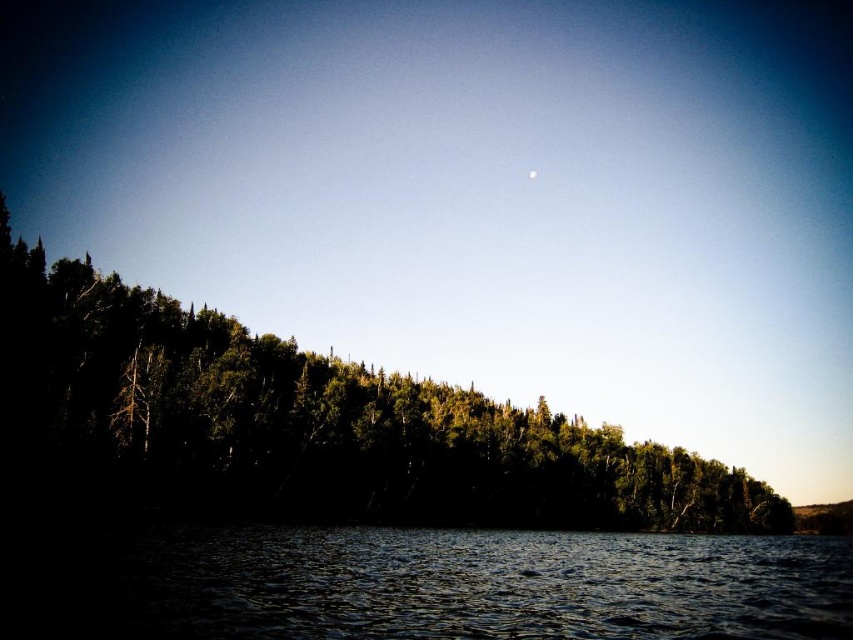
You are standing at the point marked as point (358,484) in the forest scene. You want to walk straight towards the viewer. How far will you have to walk to reach the viewer?

You will have to walk 326.34 feet to reach the viewer because the distance between point (358,484) and the viewer is 326.34 feet.

You are an astronomer observing the night sky. You notice the green leafy trees at center and the white glossy moon at upper center. Which object appears bigger in the image?

The green leafy trees at center appears larger in size than the white glossy moon at upper center in the image.